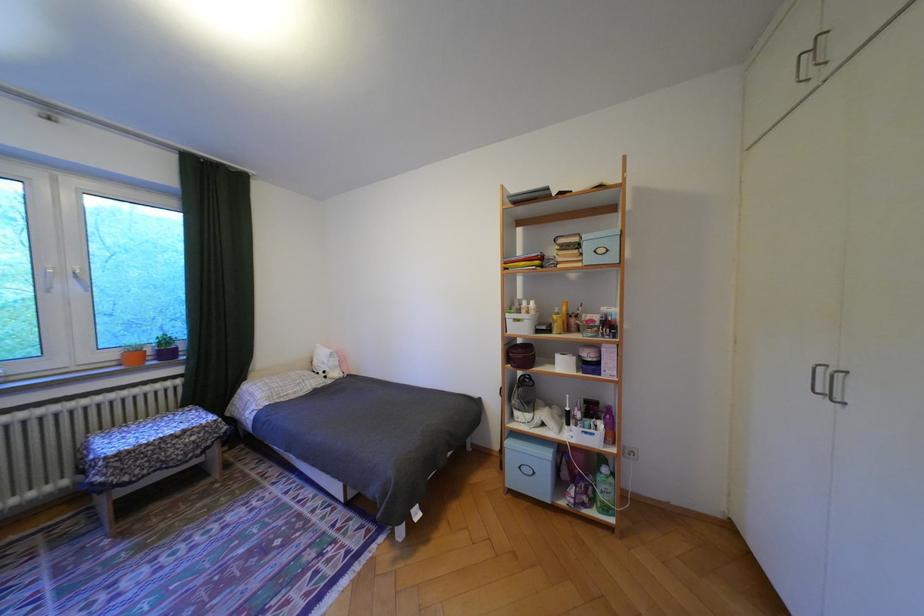
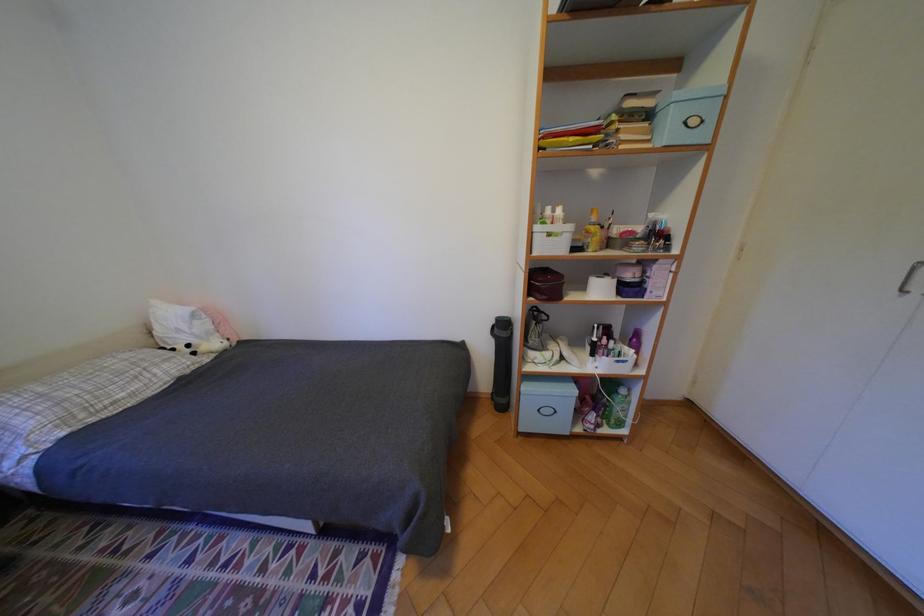
In the scene shown: The images are taken continuously from a first-person perspective. In which direction is your viewpoint rotating?

The camera's rotation is toward right-down.